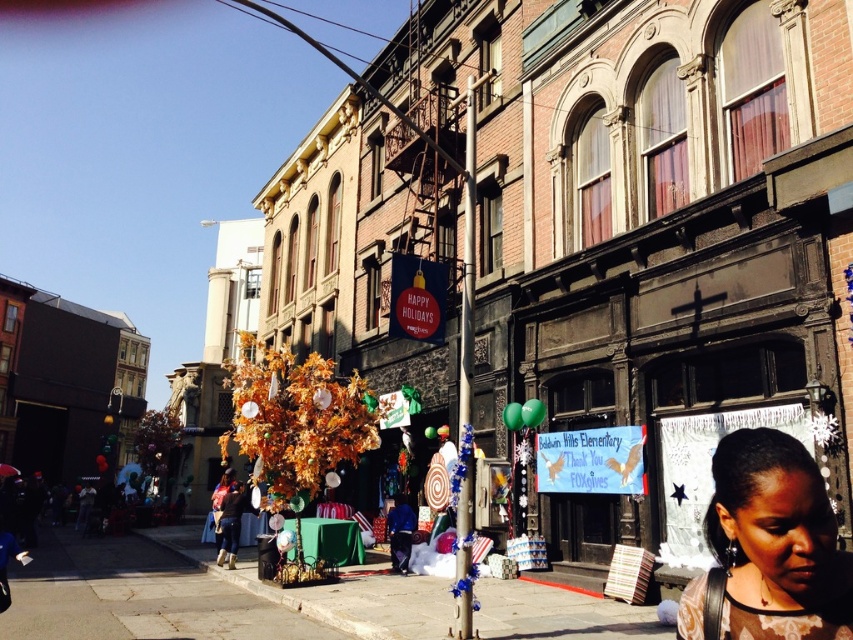
Question: Is matte brown hair at lower right wider than matte black crowd at lower left?

Choices:
 (A) yes
 (B) no

Answer: (B)

Question: Which object appears farthest from the camera in this image?

Choices:
 (A) matte brown hair at lower right
 (B) matte black crowd at lower left

Answer: (B)

Question: Is matte brown hair at lower right wider than matte black crowd at lower left?

Choices:
 (A) no
 (B) yes

Answer: (A)

Question: Is matte brown hair at lower right below matte black crowd at lower left?

Choices:
 (A) no
 (B) yes

Answer: (A)